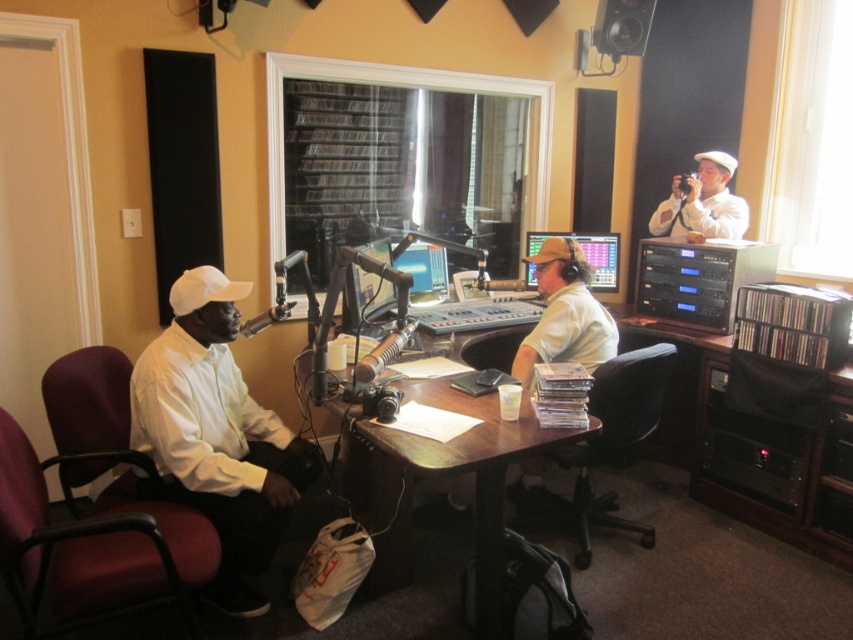
You are a technician in the radio studio and need to adjust the lighting on the white matte shirt at left. Where exactly should you direct the light based on its coordinates?

The white matte shirt at left is located at point (216, 436), so you should direct the light to that coordinate to properly illuminate it.

You are a guest speaker preparing to join the live broadcast in this studio. You need to sit in a chair that is not too small for your height. Which chair should you choose between the white matte shirt at left and the black plastic swivel chair at center?

The black plastic swivel chair at center is larger than the white matte shirt at left, so you should choose the black plastic swivel chair at center as it is more spacious for your height.